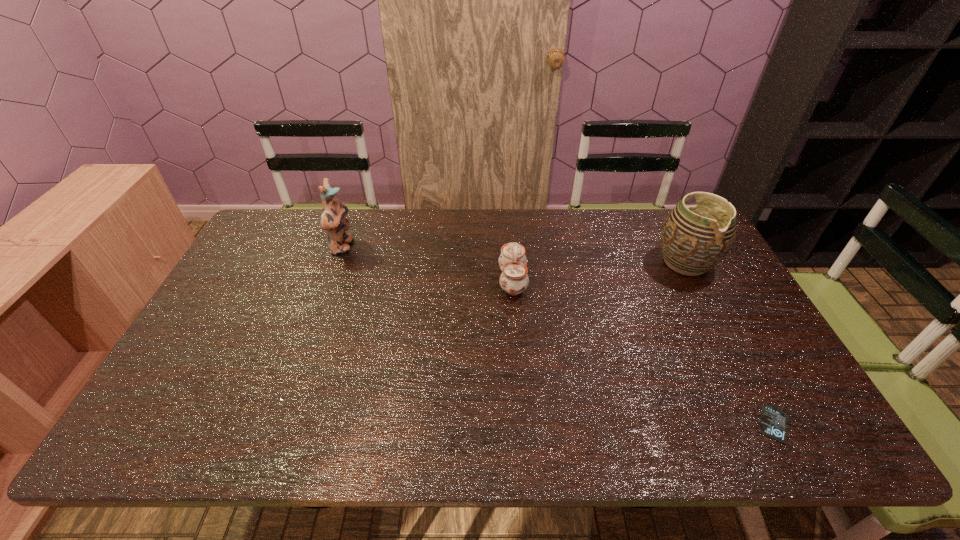
The image size is (960, 540). I want to click on figurine, so click(333, 220).

Where is `pottery`? This screenshot has width=960, height=540. pottery is located at coordinates (694, 239).

Locate an element on the screen. chinaware is located at coordinates (514, 279).

The height and width of the screenshot is (540, 960). I want to click on the third object from right to left, so click(x=514, y=279).

Image resolution: width=960 pixels, height=540 pixels. Find the location of `identity card`. identity card is located at coordinates (773, 423).

I want to click on the nearest object, so click(x=773, y=423).

The height and width of the screenshot is (540, 960). Find the location of `blank area located on the front-facing side of the figurine`. blank area located on the front-facing side of the figurine is located at coordinates tap(414, 247).

You are a GUI agent. You are given a task and a screenshot of the screen. Output one action in this format:
    pyautogui.click(x=<x>, y=<y>)
    Task: Click on the vacant point located on the front of the pottery
    
    Given the screenshot: What is the action you would take?
    pyautogui.click(x=709, y=309)

Identify the location of free space located 0.070m by the handle of the second shortest object. Image resolution: width=960 pixels, height=540 pixels. (475, 281).

Find the location of a particular element. Image resolution: width=960 pixels, height=540 pixels. vacant area located by the handle of the second shortest object is located at coordinates (468, 281).